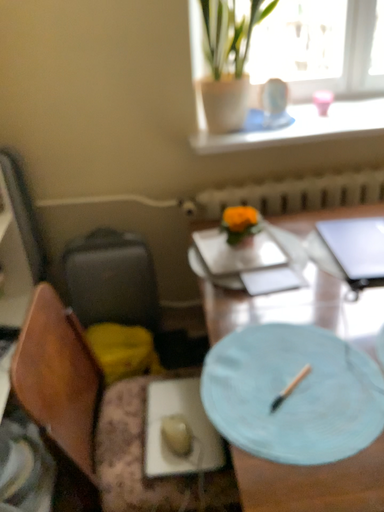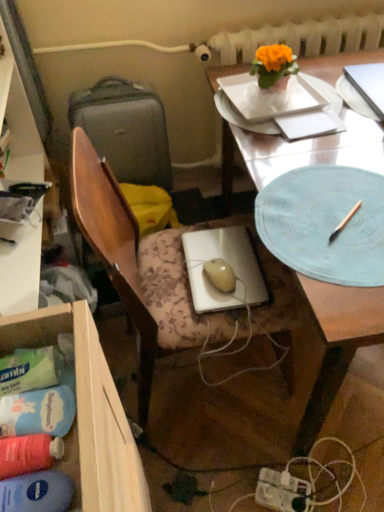
Question: How did the camera likely rotate when shooting the video?

Choices:
 (A) rotated downward
 (B) rotated upward

Answer: (A)